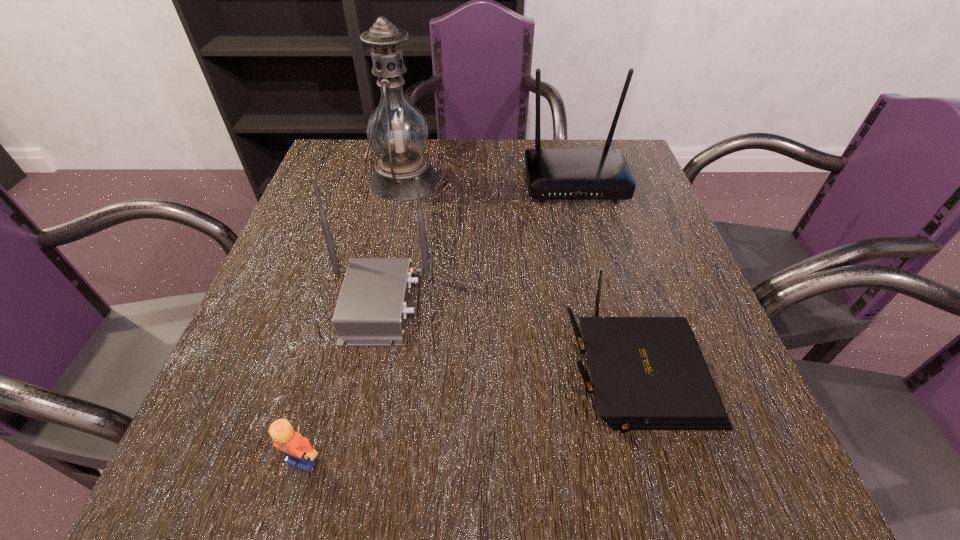
Where is `vacant point located between the farthest router and the tallest object`? vacant point located between the farthest router and the tallest object is located at coordinates pos(490,181).

Locate an element on the screen. This screenshot has height=540, width=960. empty location between the farthest router and the oil lamp is located at coordinates (490, 181).

This screenshot has width=960, height=540. What are the coordinates of `unoccupied area between the farthest router and the oil lamp` in the screenshot? It's located at (490, 181).

You are a GUI agent. You are given a task and a screenshot of the screen. Output one action in this format:
    pyautogui.click(x=<x>, y=<y>)
    Task: Click on the vacant area that lies between the shortest router and the tallest object
    The height and width of the screenshot is (540, 960).
    Given the screenshot: What is the action you would take?
    pyautogui.click(x=520, y=278)

Locate which object is the fourth closest to the shortest router. Please provide its 2D coordinates. Your answer should be formatted as a tuple, i.e. [(x, y)], where the tuple contains the x and y coordinates of a point satisfying the conditions above.

[(397, 132)]

You are a GUI agent. You are given a task and a screenshot of the screen. Output one action in this format:
    pyautogui.click(x=<x>, y=<y>)
    Task: Click on the object that is the third closest to the shortest router
    Image resolution: width=960 pixels, height=540 pixels.
    Given the screenshot: What is the action you would take?
    pyautogui.click(x=298, y=449)

Select which router appears as the second closest to the farthest router. Please provide its 2D coordinates. Your answer should be formatted as a tuple, i.e. [(x, y)], where the tuple contains the x and y coordinates of a point satisfying the conditions above.

[(648, 373)]

Identify which router is the second nearest to the shortest router. Please provide its 2D coordinates. Your answer should be formatted as a tuple, i.e. [(x, y)], where the tuple contains the x and y coordinates of a point satisfying the conditions above.

[(552, 174)]

The height and width of the screenshot is (540, 960). Find the location of `vacant area that satisfies the following two spatial constraints: 1. on the back of the leftmost router to connect cables; 2. on the front-facing side of the Lego`. vacant area that satisfies the following two spatial constraints: 1. on the back of the leftmost router to connect cables; 2. on the front-facing side of the Lego is located at coordinates (345, 460).

This screenshot has width=960, height=540. Find the location of `free space that satisfies the following two spatial constraints: 1. on the front-facing side of the shortest router; 2. on the left side of the farthest router`. free space that satisfies the following two spatial constraints: 1. on the front-facing side of the shortest router; 2. on the left side of the farthest router is located at coordinates (626, 375).